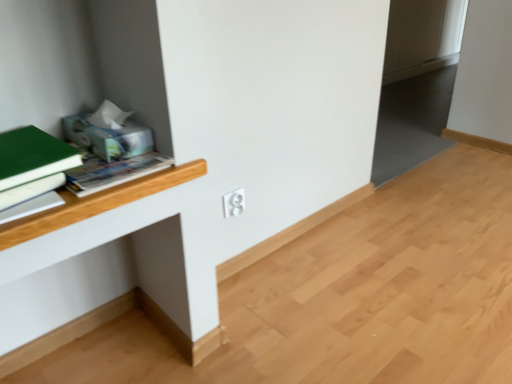
Question: From their relative heights in the image, would you say green matte book at left is taller or shorter than white matte book at left?

Choices:
 (A) short
 (B) tall

Answer: (B)

Question: From a real-world perspective, is green matte book at left positioned above or below white matte book at left?

Choices:
 (A) above
 (B) below

Answer: (A)

Question: Which of these objects is positioned closest to the green matte book at left?

Choices:
 (A) white matte book at left
 (B) white matte computer desk at center
 (C) white plastic electric outlet at center

Answer: (A)

Question: Which of these objects is positioned closest to the white plastic electric outlet at center?

Choices:
 (A) white matte computer desk at center
 (B) white matte book at left
 (C) green matte book at left

Answer: (A)